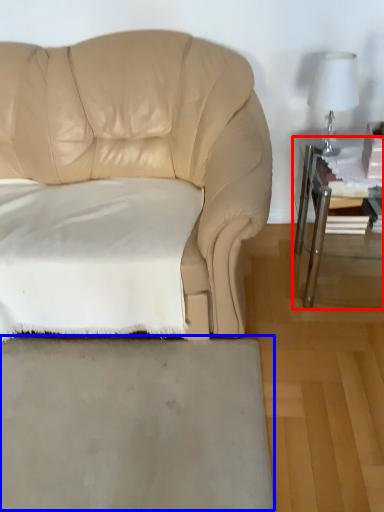
Question: Which object is further to the camera taking this photo, table (highlighted by a red box) or concrete (highlighted by a blue box)?

Choices:
 (A) table
 (B) concrete

Answer: (A)